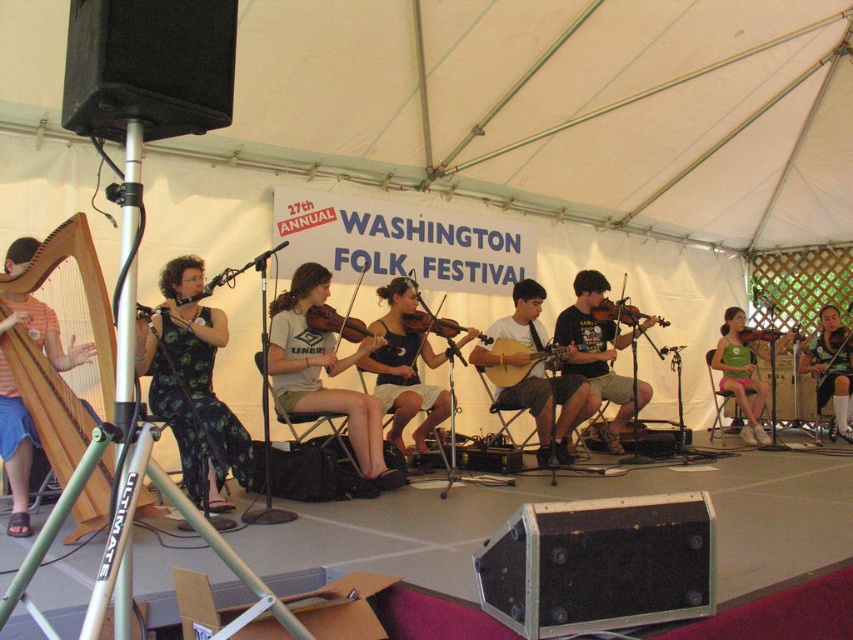
Is matte black t-shirt at center to the left of green fabric dress at center from the viewer's perspective?

Yes, matte black t-shirt at center is to the left of green fabric dress at center.

Is matte black t-shirt at center further to the viewer compared to green fabric dress at center?

No, it is in front of green fabric dress at center.

The height and width of the screenshot is (640, 853). Find the location of `matte black t-shirt at center`. matte black t-shirt at center is located at coordinates (599, 355).

Consider the image. Between light gray cotton shirt at center and green fabric shirt at center, which one is positioned higher?

Positioned higher is light gray cotton shirt at center.

Between light gray cotton shirt at center and green fabric shirt at center, which one appears on the right side from the viewer's perspective?

green fabric shirt at center

At what (x,y) coordinates should I click in order to perform the action: click on light gray cotton shirt at center. Please return your answer as a coordinate pair (x, y). This screenshot has width=853, height=640. Looking at the image, I should click on (321, 371).

At what (x,y) coordinates should I click in order to perform the action: click on light gray cotton shirt at center. Please return your answer as a coordinate pair (x, y). Looking at the image, I should click on (321, 371).

Does matte brown acoustic guitar at center appear over green fabric dress at center?

Indeed, matte brown acoustic guitar at center is positioned over green fabric dress at center.

Between matte brown acoustic guitar at center and green fabric dress at center, which one is positioned higher?

matte brown acoustic guitar at center

Which is in front, point (532, 412) or point (839, 362)?

Positioned in front is point (532, 412).

Where is `matte brown acoustic guitar at center`? matte brown acoustic guitar at center is located at coordinates (534, 376).